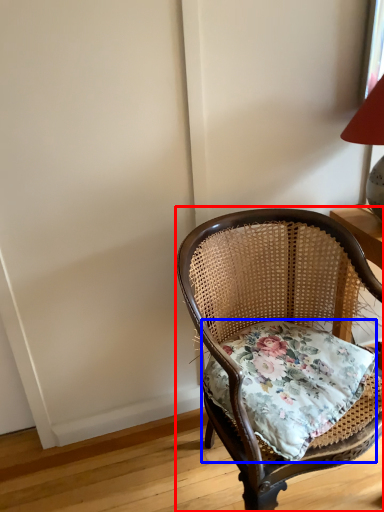
Question: Which object is further to the camera taking this photo, chair (highlighted by a red box) or pillow (highlighted by a blue box)?

Choices:
 (A) chair
 (B) pillow

Answer: (B)